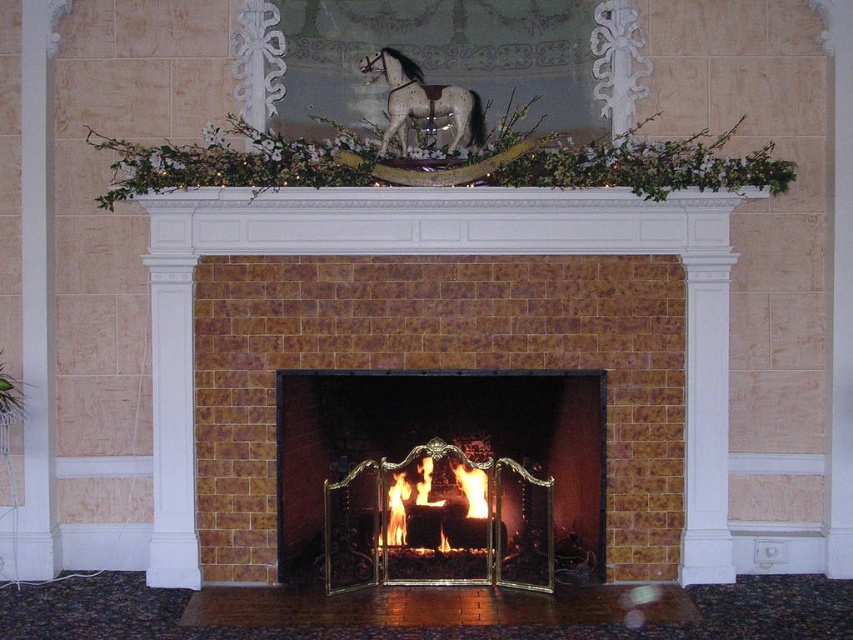
You are standing in the room and want to place a new decorative item on the mantel of the brown brick fireplace at center. Based on the coordinates provided, where should you aim to place the item?

The brown brick fireplace at center is located at coordinates point (408,356), so you should aim to place the item there.

You are an interior designer assessing the placement of items in the room. The brown brick fireplace at center and the speckled gray horse at upper center are part of the design. Which object occupies more vertical space in the scene?

The brown brick fireplace at center is taller than the speckled gray horse at upper center, so it occupies more vertical space in the scene.

Based on the photo, you are a firefighter assessing a room with a fireplace. You see a brass fireplace screen at center and flaming wood at center. Which object is taller?

The brass fireplace screen at center is taller than the flaming wood at center.